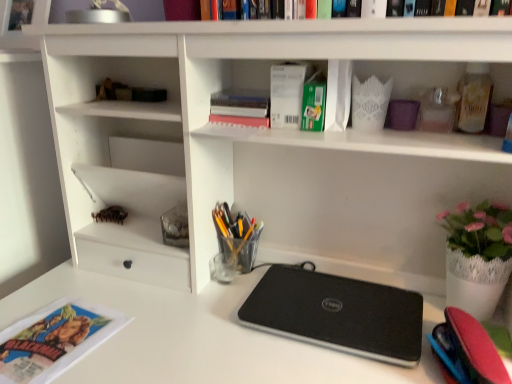
Question: Is white matte paper at upper center, positioned as the 2th paperback book in right-to-left order, inside the boundaries of translucent plastic cup at center, or outside?

Choices:
 (A) inside
 (B) outside

Answer: (B)

Question: In the image, is white matte paper at upper center, positioned as the 2th paperback book in right-to-left order, positioned in front of or behind translucent plastic cup at center?

Choices:
 (A) front
 (B) behind

Answer: (A)

Question: Estimate the real-world distances between objects in this image. Which object is farther from the green matte paperback book at upper center, which is the 2th paperback book from left to right?

Choices:
 (A) black matte laptop at center
 (B) translucent plastic cup at center
 (C) white matte paper at upper center, which appears as the 1th paperback book when viewed from the left
 (D) pink matte book at upper center
 (E) matte paper magazine at lower left

Answer: (E)

Question: Estimate the real-world distances between objects in this image. Which object is closer to the translucent plastic cup at center?

Choices:
 (A) pink matte book at upper center
 (B) white matte paper at upper center, positioned as the 2th paperback book in right-to-left order
 (C) green matte paperback book at upper center, positioned as the first paperback book in right-to-left order
 (D) black matte laptop at center
 (E) matte paper magazine at lower left

Answer: (D)